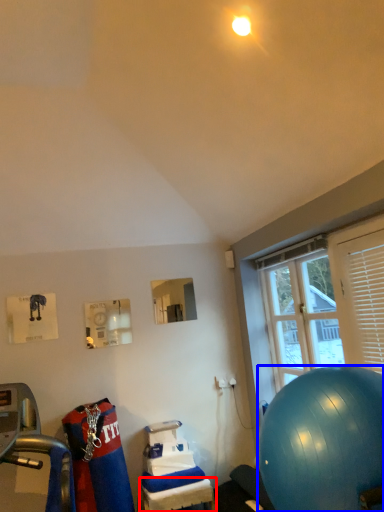
Question: Which object appears farthest to the camera in this image, table (highlighted by a red box) or ball (highlighted by a blue box)?

Choices:
 (A) table
 (B) ball

Answer: (A)